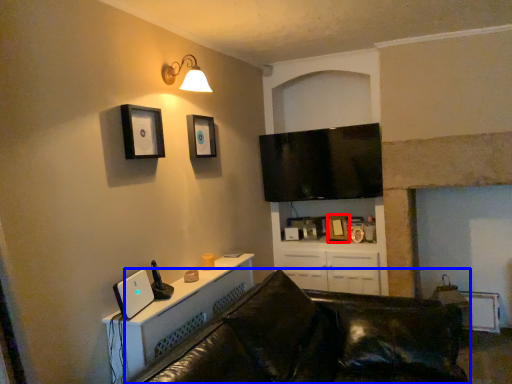
Question: Which point is closer to the camera, picture frame (highlighted by a red box) or studio couch (highlighted by a blue box)?

Choices:
 (A) picture frame
 (B) studio couch

Answer: (B)